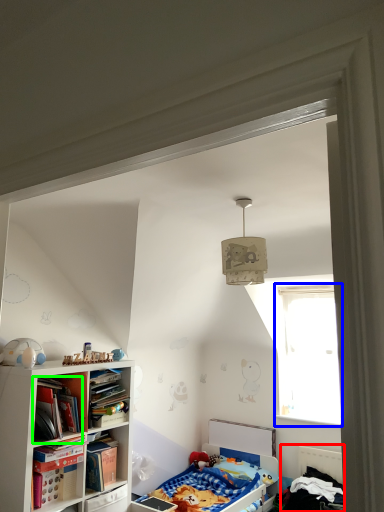
Question: Estimate the real-world distances between objects in this image. Which object is closer to bed (highlighted by a red box), window (highlighted by a blue box) or book (highlighted by a green box)?

Choices:
 (A) window
 (B) book

Answer: (A)